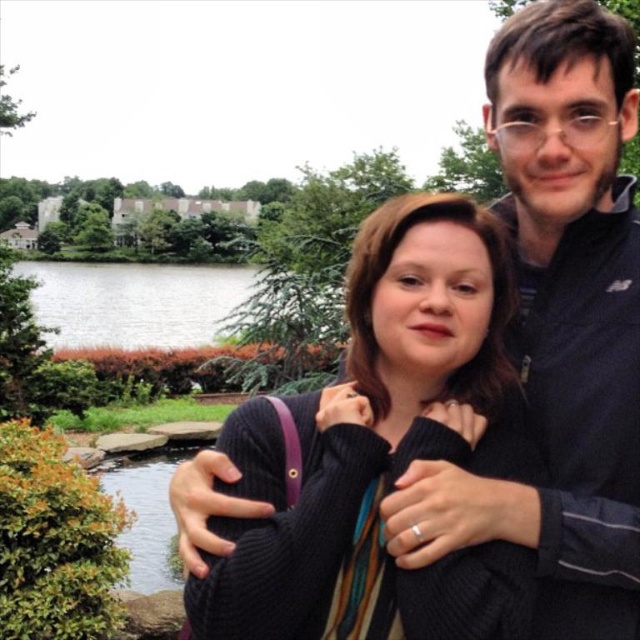
Where is the black sweater at center located in the image?

The black sweater at center is located at point (x=381, y=449) in the image.

You are a photographer trying to capture a photo of the black sweater at center and the green grass at lower left. Which object is positioned closer to the front of the image?

The black sweater at center is closer to the viewer than the green grass at lower left, so it is positioned closer to the front of the image.

You are a photographer trying to capture a close shot of the black sweater at center and the green grass at lower left. Since you want both to be in focus, which object should you focus on first to ensure the other is also sharp?

The black sweater at center has a smaller size compared to green grass at lower left, so you should focus on the black sweater at center first to ensure both are in focus.